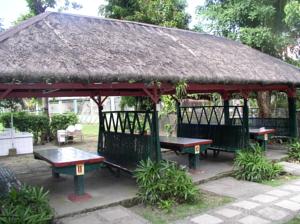
Identify the location of gaps besides tables. This screenshot has height=224, width=300. (25, 171), (106, 165), (167, 153), (219, 144), (251, 137), (278, 131).